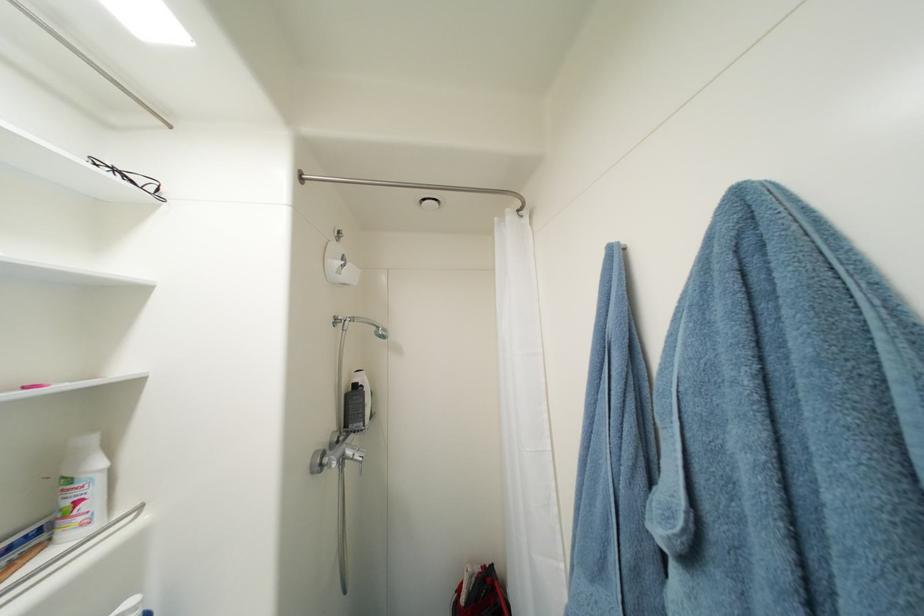
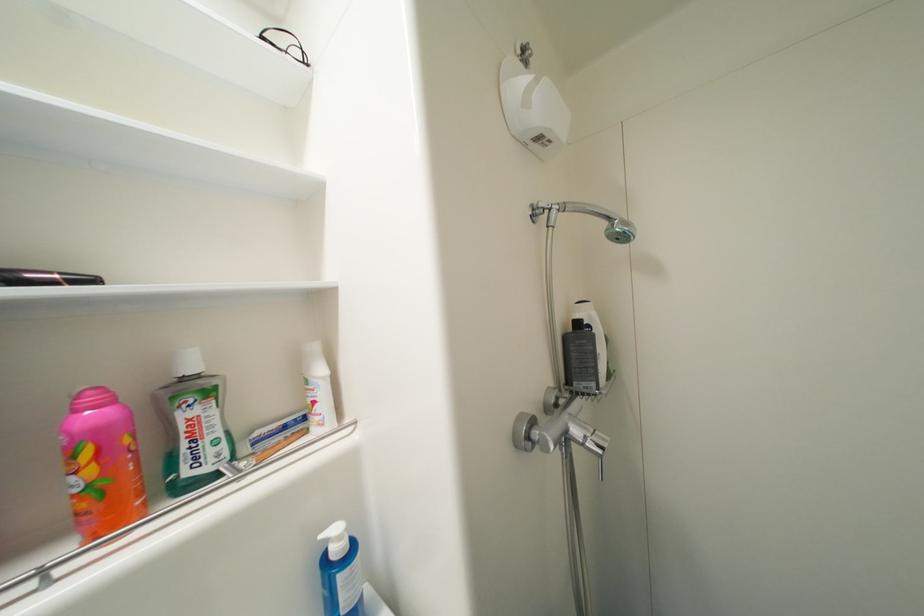
Question: How did the camera likely rotate?

Choices:
 (A) Left
 (B) Right
 (C) Up
 (D) Down

Answer: (A)